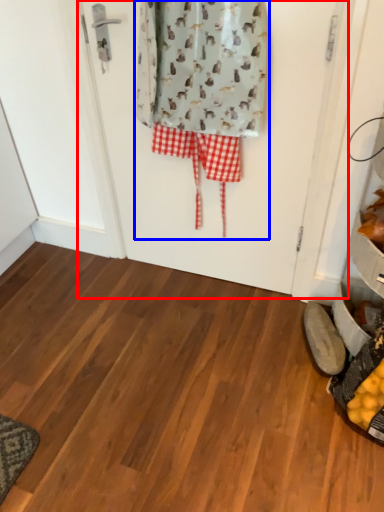
Question: Which object appears farthest to the camera in this image, screen door (highlighted by a red box) or laundry (highlighted by a blue box)?

Choices:
 (A) screen door
 (B) laundry

Answer: (A)